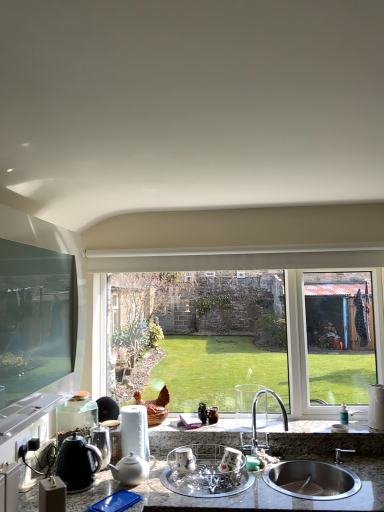
Question: Does black matte tea pot at lower left, which is the second tea pot in right-to-left order, have a lesser width compared to clear plastic dish rack at center, the 2th appliance viewed from the right?

Choices:
 (A) yes
 (B) no

Answer: (A)

Question: Is the depth of black matte tea pot at lower left, which is the second tea pot in right-to-left order, greater than that of clear plastic dish rack at center, placed as the 1th appliance when sorted from front to back?

Choices:
 (A) no
 (B) yes

Answer: (B)

Question: Is black matte tea pot at lower left, positioned as the 1th tea pot in left-to-right order, positioned with its back to clear plastic dish rack at center, arranged as the third appliance when viewed from the back?

Choices:
 (A) no
 (B) yes

Answer: (A)

Question: From a real-world perspective, is black matte tea pot at lower left, positioned as the 1th tea pot in left-to-right order, below clear plastic dish rack at center, placed as the 1th appliance when sorted from front to back?

Choices:
 (A) no
 (B) yes

Answer: (A)

Question: From the image's perspective, would you say black matte tea pot at lower left, positioned as the 1th tea pot in left-to-right order, is positioned over clear plastic dish rack at center, placed as the 1th appliance when sorted from front to back?

Choices:
 (A) yes
 (B) no

Answer: (A)

Question: From a real-world perspective, does black matte tea pot at lower left, positioned as the 1th tea pot in left-to-right order, stand above clear plastic dish rack at center, the 2th appliance viewed from the right?

Choices:
 (A) yes
 (B) no

Answer: (A)

Question: Is satin nickel faucet at center turned away from clear plastic dish rack at center, placed as the 1th appliance when sorted from front to back?

Choices:
 (A) no
 (B) yes

Answer: (A)

Question: Is satin nickel faucet at center touching clear plastic dish rack at center, the 2th appliance viewed from the right?

Choices:
 (A) no
 (B) yes

Answer: (A)

Question: Is clear plastic dish rack at center, the 2th appliance viewed from the right, completely or partially inside satin nickel faucet at center?

Choices:
 (A) no
 (B) yes

Answer: (A)

Question: Is satin nickel faucet at center taller than clear plastic dish rack at center, arranged as the third appliance when viewed from the back?

Choices:
 (A) yes
 (B) no

Answer: (A)

Question: Considering the relative sizes of satin nickel faucet at center and clear plastic dish rack at center, arranged as the third appliance when viewed from the back, in the image provided, is satin nickel faucet at center wider than clear plastic dish rack at center, arranged as the third appliance when viewed from the back,?

Choices:
 (A) no
 (B) yes

Answer: (A)

Question: From a real-world perspective, is satin nickel faucet at center on top of clear plastic dish rack at center, marked as the 2th appliance in a left-to-right arrangement?

Choices:
 (A) no
 (B) yes

Answer: (B)

Question: Is black matte tea pot at lower left, which is the second tea pot in right-to-left order, thinner than satin nickel faucet at center?

Choices:
 (A) yes
 (B) no

Answer: (A)